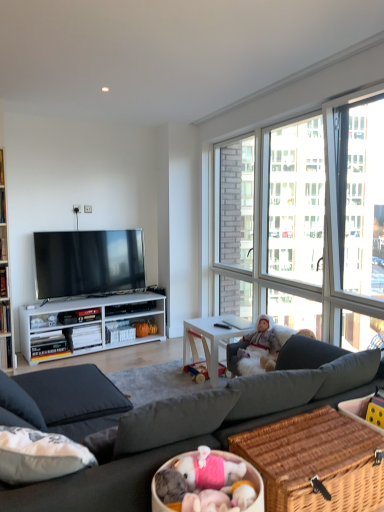
Question: Is matte black tv at center not close to white wood desk at center?

Choices:
 (A) yes
 (B) no

Answer: (A)

Question: Is matte black tv at center not inside white wood desk at center?

Choices:
 (A) yes
 (B) no

Answer: (A)

Question: Considering the relative positions of matte black tv at center and white wood desk at center in the image provided, is matte black tv at center to the right of white wood desk at center from the viewer's perspective?

Choices:
 (A) no
 (B) yes

Answer: (A)

Question: Does matte black tv at center have a greater width compared to white wood desk at center?

Choices:
 (A) yes
 (B) no

Answer: (B)

Question: Does matte black tv at center have a greater height compared to white wood desk at center?

Choices:
 (A) no
 (B) yes

Answer: (B)

Question: Considering the positions of woven brown picnic basket at lower right and matte black tv at center in the image, is woven brown picnic basket at lower right wider or thinner than matte black tv at center?

Choices:
 (A) wide
 (B) thin

Answer: (A)

Question: In terms of size, does woven brown picnic basket at lower right appear bigger or smaller than matte black tv at center?

Choices:
 (A) big
 (B) small

Answer: (B)

Question: In terms of height, does woven brown picnic basket at lower right look taller or shorter compared to matte black tv at center?

Choices:
 (A) tall
 (B) short

Answer: (B)

Question: Does point (332, 459) appear closer or farther from the camera than point (54, 273)?

Choices:
 (A) closer
 (B) farther

Answer: (A)

Question: Would you say white plush doll at center is inside or outside dark gray fabric couch at center?

Choices:
 (A) outside
 (B) inside

Answer: (B)

Question: Is point (264, 313) positioned closer to the camera than point (279, 416)?

Choices:
 (A) closer
 (B) farther

Answer: (B)

Question: From the image's perspective, is white plush doll at center positioned above or below dark gray fabric couch at center?

Choices:
 (A) above
 (B) below

Answer: (A)

Question: Would you say white plush doll at center is to the left or to the right of dark gray fabric couch at center in the picture?

Choices:
 (A) left
 (B) right

Answer: (B)

Question: Is white wood desk at center situated inside white plush doll at center or outside?

Choices:
 (A) inside
 (B) outside

Answer: (B)

Question: Is point (213, 380) positioned closer to the camera than point (269, 325)?

Choices:
 (A) closer
 (B) farther

Answer: (A)